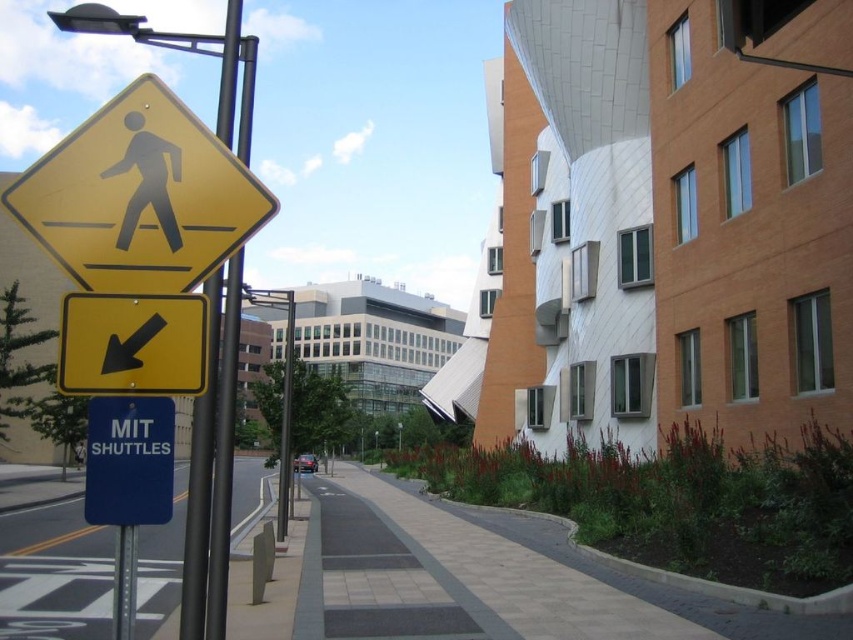
Consider the image. You are a pedestrian trying to find the MIT shuttles. You see the blue metallic sign at lower left and the black plastic pedestrian sign at upper left. Which sign should you look at to find the direction to the MIT shuttles?

The blue metallic sign at lower left has a larger size compared to the black plastic pedestrian sign at upper left, so you should look at the blue metallic sign at lower left since it is more prominent and likely contains the information about the MIT shuttles.

You are standing at the pedestrian crossing sign and want to take a photo of the modern building on the right. Which point, point(125, 362) or point(131, 516), is closer to your camera when focusing on the building?

Point(131, 516) is closer to the camera than point(125, 362), so you should focus on point(131, 516) to capture the building properly.